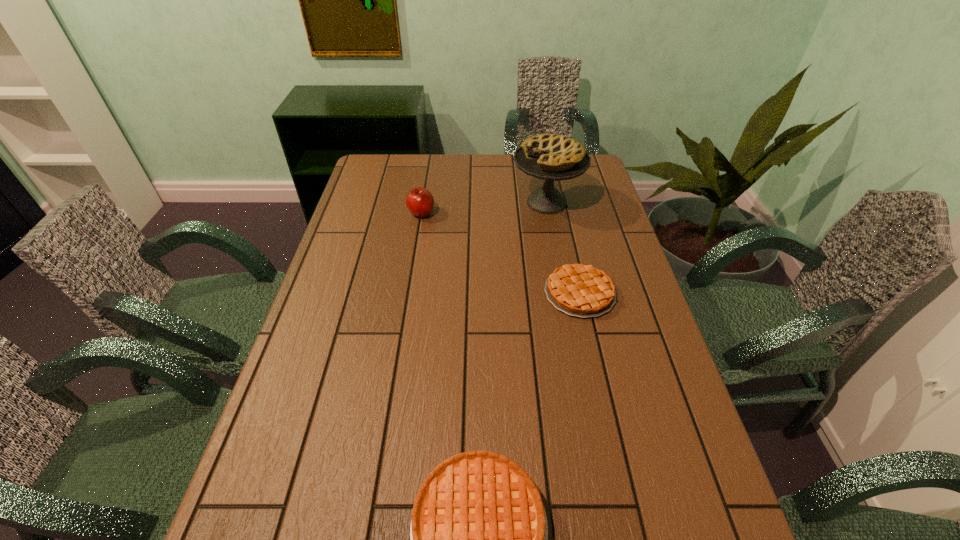
At what (x,y) coordinates should I click in order to perform the action: click on vacant region that satisfies the following two spatial constraints: 1. on the cut side of the shortest object; 2. on the right side of the farthest pie. Please return your answer as a coordinate pair (x, y). Image resolution: width=960 pixels, height=540 pixels. Looking at the image, I should click on (564, 293).